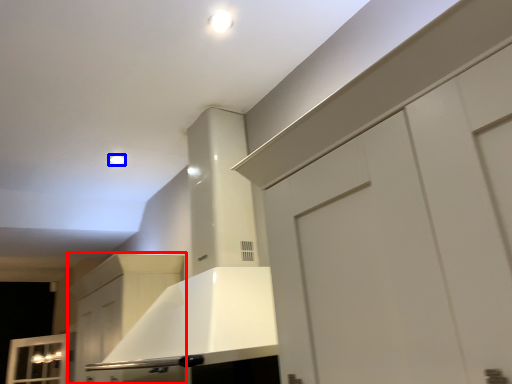
Question: Which object is closer to the camera taking this photo, cabinetry (highlighted by a red box) or lighting (highlighted by a blue box)?

Choices:
 (A) cabinetry
 (B) lighting

Answer: (A)